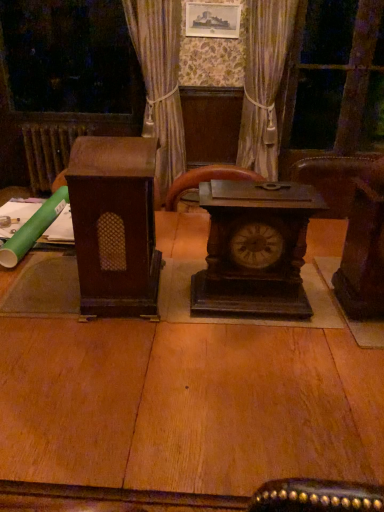
Locate an element on the screen. vacant space to the left of dark wood chair at right, which is counted as the second furniture, starting from the left is located at coordinates (319, 309).